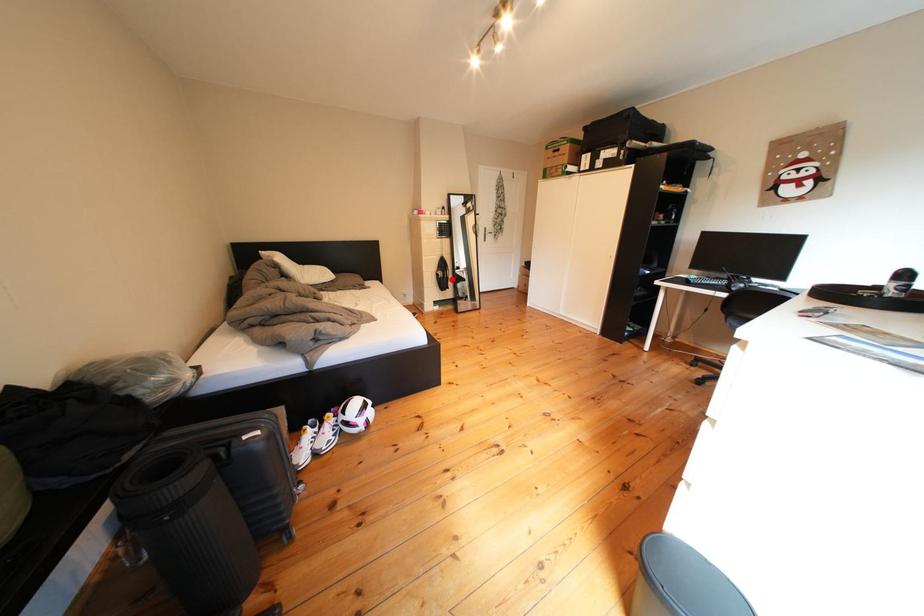
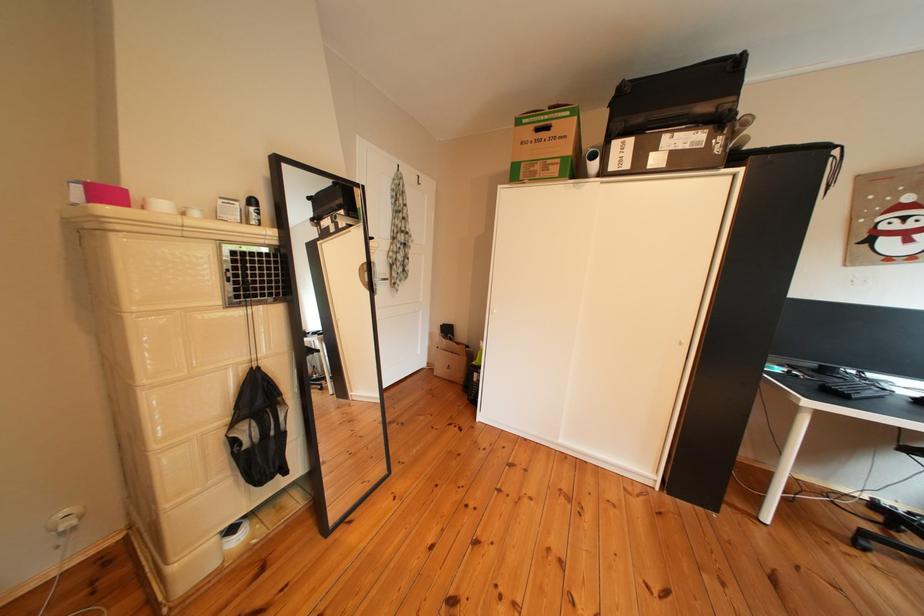
Question: I am providing you with two images of the same scene from different viewpoints. A red point is shown in image1. For the corresponding object point in image2, is it positioned nearer or farther from the camera?

Choices:
 (A) Nearer
 (B) Farther

Answer: (B)